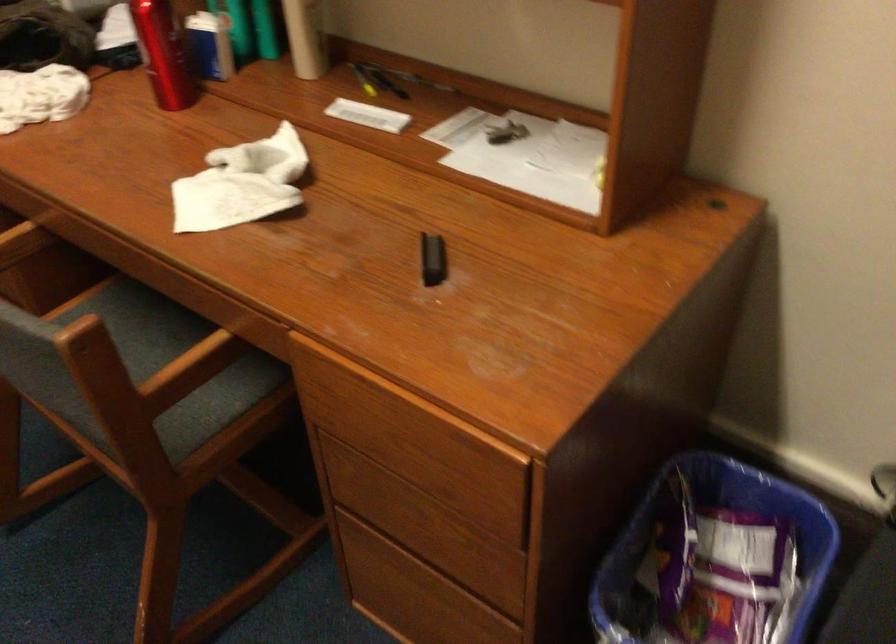
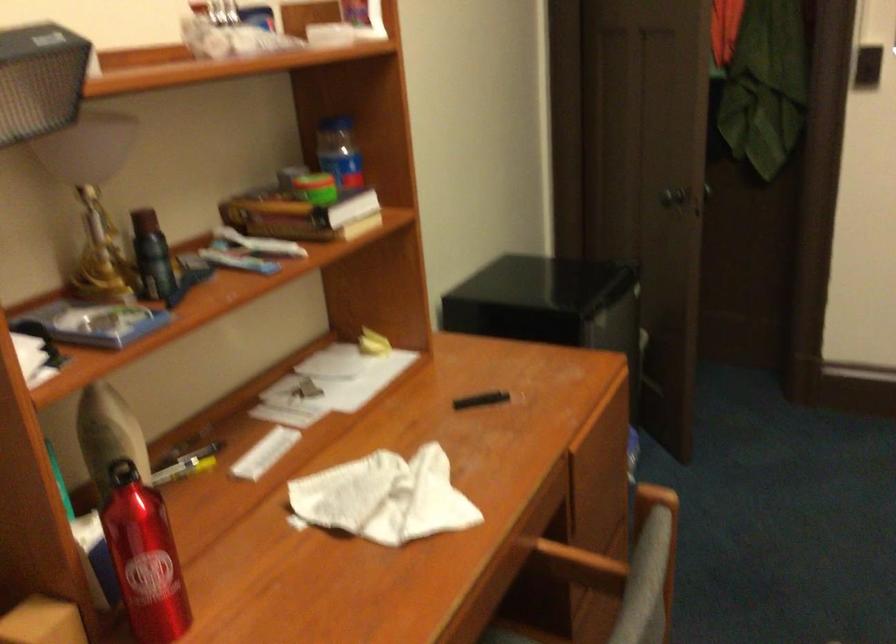
Question: I am providing you with two images of the same scene from different viewpoints. Which of the following objects are not visible in image2?

Choices:
 (A) black marker
 (B) blue trash can
 (C) silver decorative vase
 (D) door knob

Answer: (B)